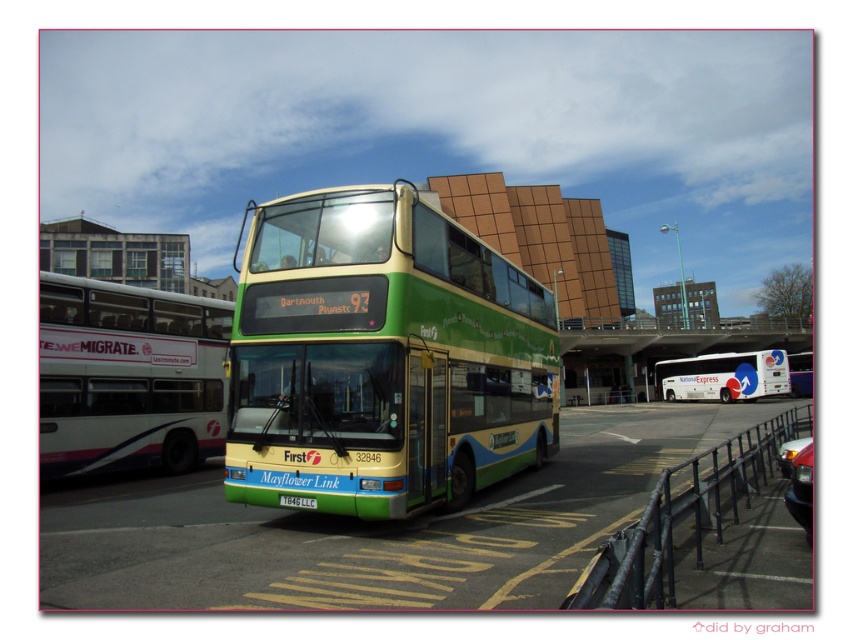
Looking at this image, can you confirm if green rubber bus at center is shorter than white glossy bus at left?

Indeed, green rubber bus at center has a lesser height compared to white glossy bus at left.

Is point (122, 548) positioned in front of point (131, 339)?

Yes, it is.

I want to click on green rubber bus at center, so click(372, 529).

Which is above, green matte/deck bus at center or white glossy bus at left?

white glossy bus at left

Consider the image. Can you confirm if green matte/deck bus at center is taller than white glossy bus at left?

Answer: Indeed, green matte/deck bus at center has a greater height compared to white glossy bus at left.

Who is more forward, (544, 317) or (160, 394)?

Point (160, 394) is in front.

At what (x,y) coordinates should I click in order to perform the action: click on green matte/deck bus at center. Please return your answer as a coordinate pair (x, y). The height and width of the screenshot is (640, 853). Looking at the image, I should click on (383, 356).

Is green rubber bus at center behind green plastic license plate at center?

No, it is in front of green plastic license plate at center.

Does green rubber bus at center have a smaller size compared to green plastic license plate at center?

No.

Describe the element at coordinates (372, 529) in the screenshot. I see `green rubber bus at center` at that location.

You are a GUI agent. You are given a task and a screenshot of the screen. Output one action in this format:
    pyautogui.click(x=<x>, y=<y>)
    Task: Click on the green rubber bus at center
    The height and width of the screenshot is (640, 853).
    Given the screenshot: What is the action you would take?
    pyautogui.click(x=372, y=529)